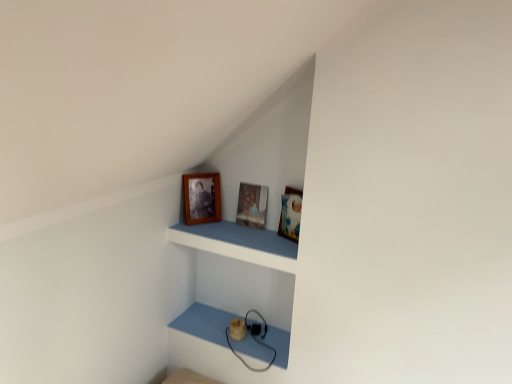
Question: Is wooden photo frame at upper center, which is counted as the second picture frame, starting from the right, wider or thinner than wooden picture frame at center, positioned as the 2th picture frame in left-to-right order?

Choices:
 (A) thin
 (B) wide

Answer: (A)

Question: Is wooden photo frame at upper center, placed as the 1th picture frame when sorted from left to right, inside the boundaries of wooden picture frame at center, which is the first picture frame in right-to-left order, or outside?

Choices:
 (A) outside
 (B) inside

Answer: (A)

Question: Which object is the closest to the wooden frame at upper center?

Choices:
 (A) wooden picture frame at center, positioned as the 2th picture frame in left-to-right order
 (B) wooden photo frame at upper center, placed as the 1th picture frame when sorted from left to right

Answer: (A)

Question: Which object is positioned closest to the wooden picture frame at center, positioned as the 2th picture frame in left-to-right order?

Choices:
 (A) wooden photo frame at upper center, which is counted as the second picture frame, starting from the right
 (B) wooden frame at upper center

Answer: (B)